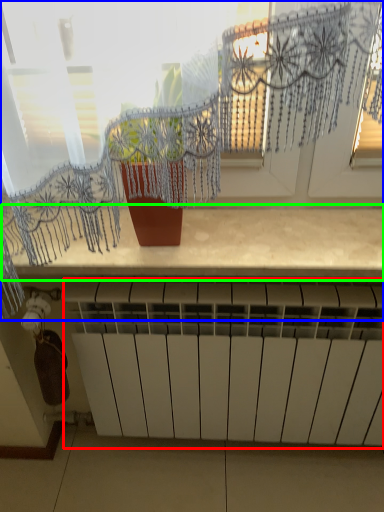
Question: Estimate the real-world distances between objects in this image. Which object is farther from radiator (highlighted by a red box), window (highlighted by a blue box) or counter top (highlighted by a green box)?

Choices:
 (A) window
 (B) counter top

Answer: (A)